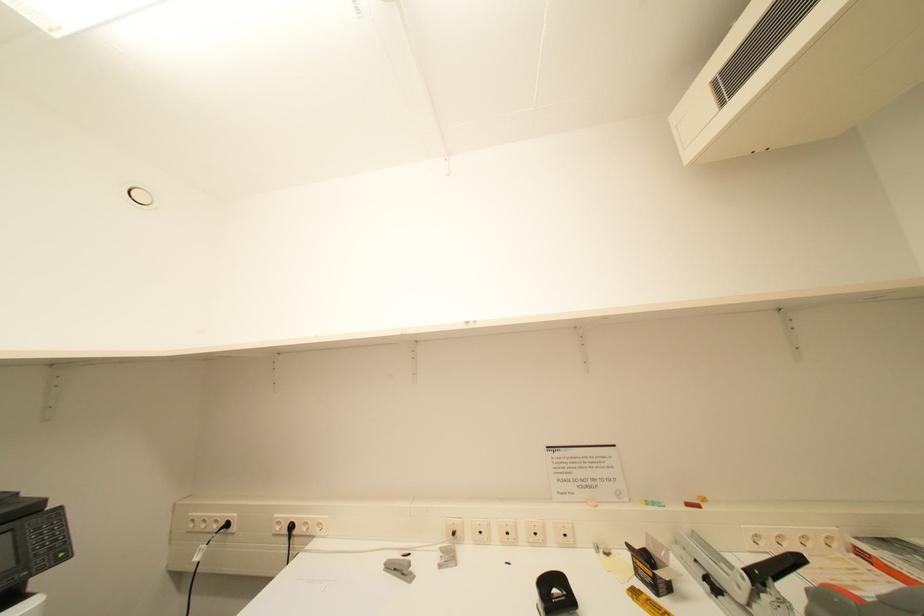
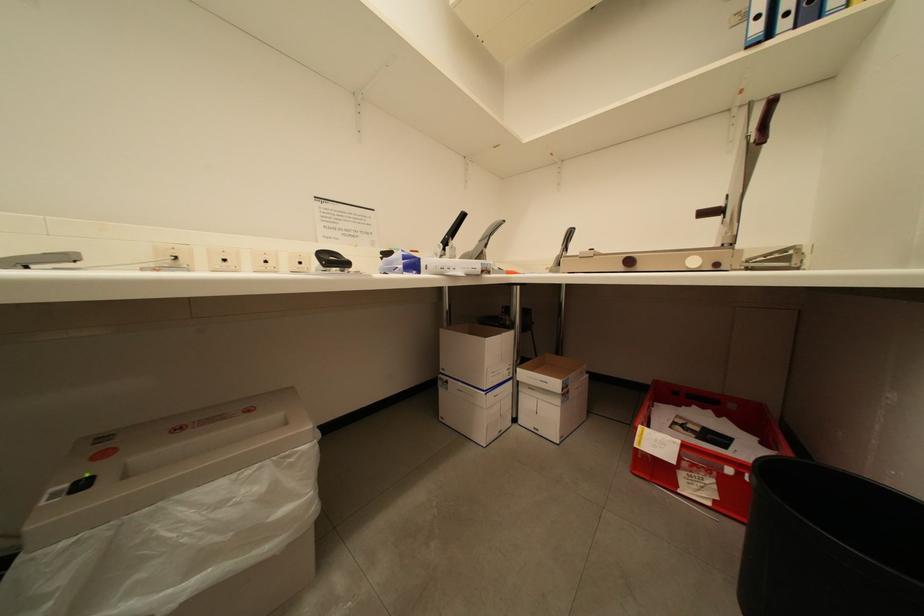
Question: The camera is either moving clockwise (left) or counter-clockwise (right) around the object. The first image is from the beginning of the video and the second image is from the end. Is the camera moving left or right when shooting the video?

Choices:
 (A) Left
 (B) Right

Answer: (A)